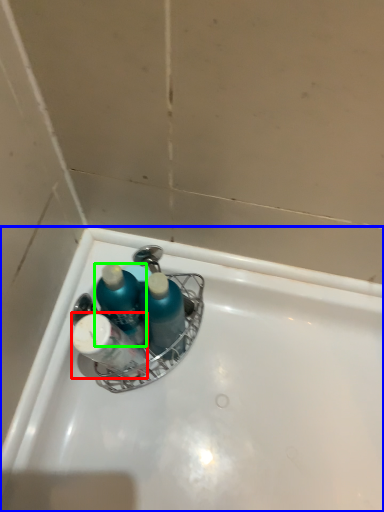
Question: Which is farther away from toiletry (highlighted by a red box)? bathtub (highlighted by a blue box) or mouthwash (highlighted by a green box)?

Choices:
 (A) bathtub
 (B) mouthwash

Answer: (A)